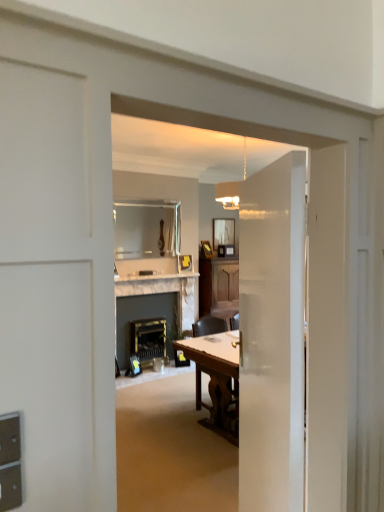
Question: Is metallic brass fireplace at center spatially inside wooden table at center, or outside of it?

Choices:
 (A) inside
 (B) outside

Answer: (B)

Question: From the image's perspective, is metallic brass fireplace at center located above or below wooden table at center?

Choices:
 (A) below
 (B) above

Answer: (B)

Question: Which object is positioned closest to the matte glass mirror at upper center, acting as the 2th mirror starting from the left?

Choices:
 (A) white marble fireplace at center
 (B) clear glass mirror at upper center, positioned as the second mirror in right-to-left order
 (C) wooden chair at center
 (D) metallic brass fireplace at center
 (E) white marble fireplace at center

Answer: (A)

Question: Estimate the real-world distances between objects in this image. Which object is closer to the metallic brass fireplace at center?

Choices:
 (A) clear glass mirror at upper center, which appears as the second mirror when viewed from the back
 (B) wooden table at center
 (C) wooden chair at center
 (D) white glossy door at center
 (E) white marble fireplace at center

Answer: (E)